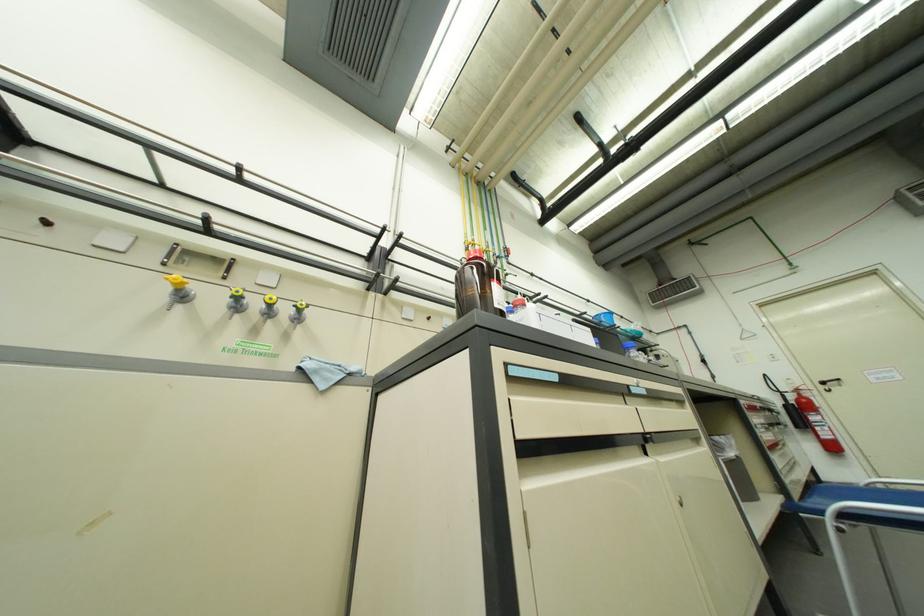
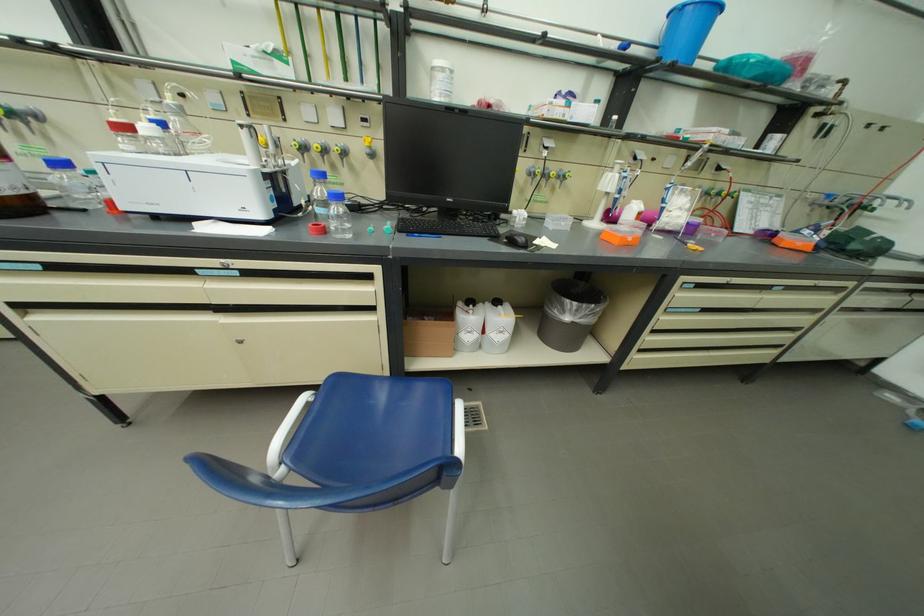
Find the pixel in the second image that matches point (740, 456) in the first image.

(577, 320)